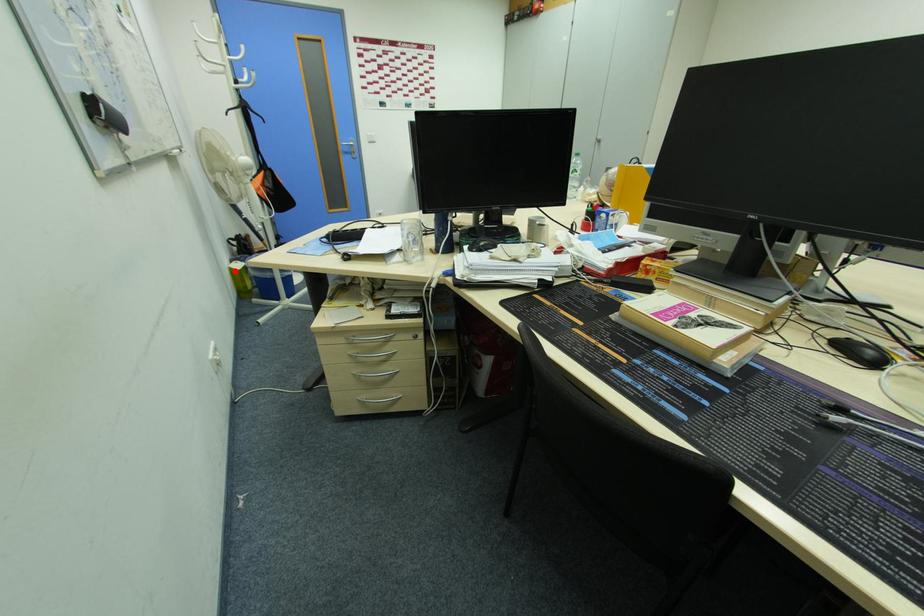
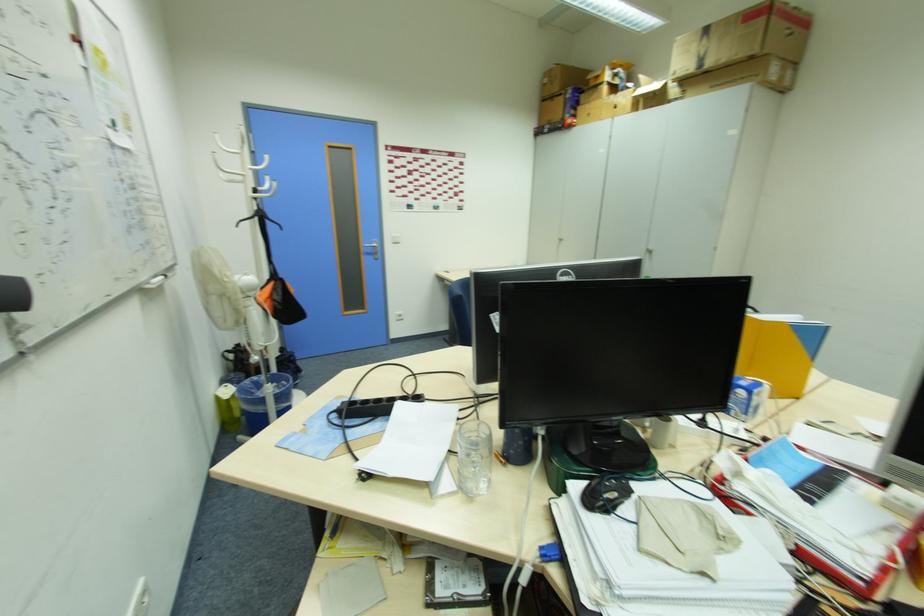
Question: I am providing you with two images of the same scene from different viewpoints. Image1 has a red point marked. In image2, the corresponding 3D location appears at what relative position? Reply with the corresponding letter.

Choices:
 (A) Closer
 (B) Farther

Answer: (B)